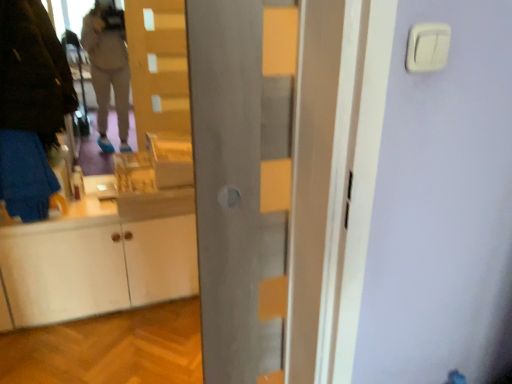
Question: Does metallic gray door at center have a greater width compared to white plastic light switch at upper right?

Choices:
 (A) no
 (B) yes

Answer: (B)

Question: Is metallic gray door at center looking in the opposite direction of white plastic light switch at upper right?

Choices:
 (A) yes
 (B) no

Answer: (B)

Question: Considering the relative sizes of metallic gray door at center and white plastic light switch at upper right in the image provided, is metallic gray door at center taller than white plastic light switch at upper right?

Choices:
 (A) yes
 (B) no

Answer: (A)

Question: From a real-world perspective, is metallic gray door at center positioned over white plastic light switch at upper right based on gravity?

Choices:
 (A) yes
 (B) no

Answer: (B)

Question: From a real-world perspective, does metallic gray door at center sit lower than white plastic light switch at upper right?

Choices:
 (A) yes
 (B) no

Answer: (A)

Question: Does point (253, 117) appear closer or farther from the camera than point (428, 48)?

Choices:
 (A) closer
 (B) farther

Answer: (B)

Question: From a real-world perspective, is metallic gray door at center physically located above or below white plastic light switch at upper right?

Choices:
 (A) below
 (B) above

Answer: (A)

Question: Choose the correct answer: Is metallic gray door at center inside white plastic light switch at upper right or outside it?

Choices:
 (A) inside
 (B) outside

Answer: (B)

Question: From the image's perspective, is metallic gray door at center positioned above or below white plastic light switch at upper right?

Choices:
 (A) above
 (B) below

Answer: (B)

Question: Is point (304, 185) closer or farther from the camera than point (37, 64)?

Choices:
 (A) closer
 (B) farther

Answer: (A)

Question: In terms of size, does metallic gray door at center appear bigger or smaller than dark brown leather jacket at left?

Choices:
 (A) small
 (B) big

Answer: (A)

Question: Is metallic gray door at center inside or outside of dark brown leather jacket at left?

Choices:
 (A) outside
 (B) inside

Answer: (A)

Question: Looking at their shapes, would you say metallic gray door at center is wider or thinner than dark brown leather jacket at left?

Choices:
 (A) thin
 (B) wide

Answer: (A)

Question: From a real-world perspective, is white plastic light switch at upper right positioned above or below dark brown leather jacket at left?

Choices:
 (A) above
 (B) below

Answer: (A)

Question: Considering their positions, is white plastic light switch at upper right located in front of or behind dark brown leather jacket at left?

Choices:
 (A) behind
 (B) front

Answer: (B)